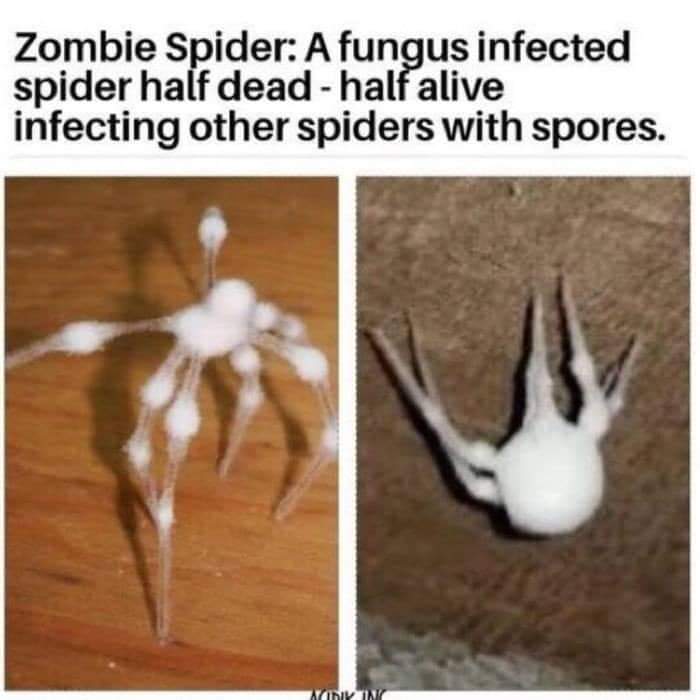
Locate an element on the screen. white strip between photos is located at coordinates (348, 327).